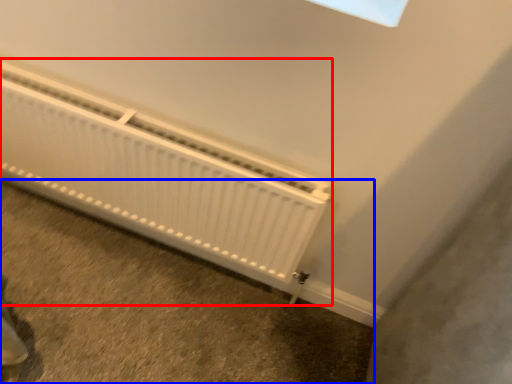
Question: Which point is further to the camera, radiator (highlighted by a red box) or concrete (highlighted by a blue box)?

Choices:
 (A) radiator
 (B) concrete

Answer: (B)